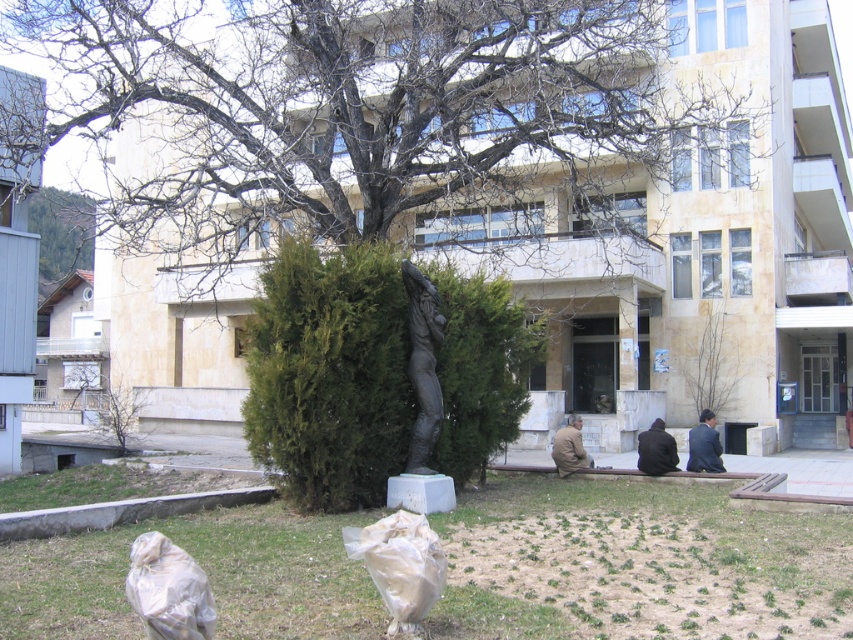
You are standing at the point marked as point (167, 589) in the image. What object is located at your current position?

The transparent plastic bag at lower left is located at point (167, 589).

Looking at this image, you are a delivery person trying to place a package on the dark matte jacket at lower center. However, there is a green leafy bush at center in the way. Can you place the package there without moving the bush?

The green leafy bush at center is positioned over the dark matte jacket at lower center, so the package cannot be placed there without moving the bush.